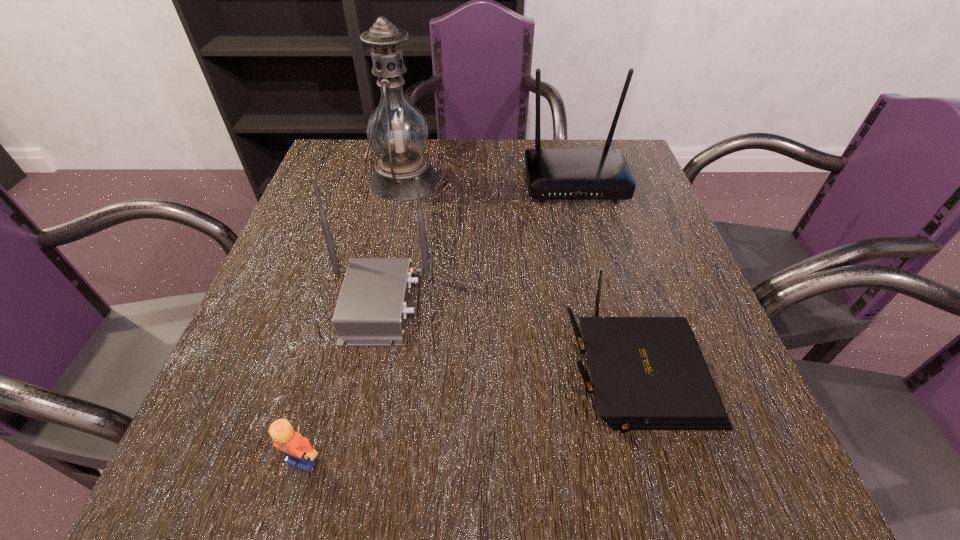
In order to click on vacant space at the far edge of the desktop in this screenshot , I will do `click(511, 152)`.

Where is `free location at the left edge`? This screenshot has height=540, width=960. free location at the left edge is located at coordinates (240, 422).

The image size is (960, 540). Identify the location of vacant region at the right edge of the desktop. (604, 252).

Locate an element on the screen. This screenshot has height=540, width=960. vacant space at the far left corner of the desktop is located at coordinates (329, 159).

Locate an element on the screen. This screenshot has width=960, height=540. free region at the near left corner is located at coordinates (228, 467).

Locate an element on the screen. vacant space at the far right corner is located at coordinates (588, 148).

The image size is (960, 540). Identify the location of free area in between the shortest router and the Lego. click(469, 417).

Locate an element on the screen. free point between the oil lamp and the leftmost router is located at coordinates (392, 242).

You are a GUI agent. You are given a task and a screenshot of the screen. Output one action in this format:
    pyautogui.click(x=<x>, y=<y>)
    Task: Click on the free space between the tallest object and the leftmost router
    The image size is (960, 540).
    Given the screenshot: What is the action you would take?
    pyautogui.click(x=392, y=242)

Identify the location of blank region between the leftmost router and the Lego. The image size is (960, 540). (340, 382).